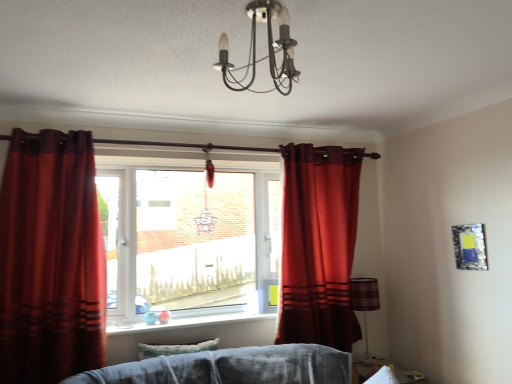
What do you see at coordinates (318, 245) in the screenshot? The image size is (512, 384). I see `matte red curtain at center, arranged as the 1th curtain when viewed from the right` at bounding box center [318, 245].

What do you see at coordinates (50, 259) in the screenshot? I see `velvet red curtain at left, the first curtain viewed from the left` at bounding box center [50, 259].

Where is `metallic chandelier at upper center`? metallic chandelier at upper center is located at coordinates (268, 50).

The height and width of the screenshot is (384, 512). What do you see at coordinates (193, 237) in the screenshot?
I see `clear glass window at center` at bounding box center [193, 237].

The width and height of the screenshot is (512, 384). What are the coordinates of `smooth glass window sill at center` in the screenshot? It's located at (182, 322).

Locate an element on the screen. matte red curtain at center, arranged as the 1th curtain when viewed from the right is located at coordinates (318, 245).

Is metallic chandelier at upper center positioned behind velvet red curtain at left, the first curtain viewed from the left?

No, it is not.

Is metallic chandelier at upper center to the left of velvet red curtain at left, the 2th curtain viewed from the back, from the viewer's perspective?

No.

Is metallic chandelier at upper center thinner than velvet red curtain at left, arranged as the second curtain when viewed from the right?

No.

Considering the sizes of objects metallic chandelier at upper center and velvet red curtain at left, the first curtain viewed from the left, in the image provided, who is bigger, metallic chandelier at upper center or velvet red curtain at left, the first curtain viewed from the left,?

velvet red curtain at left, the first curtain viewed from the left, is bigger.

Considering the sizes of objects metallic reflective picture frame at upper right and plaid fabric lampshade at lower right in the image provided, who is smaller, metallic reflective picture frame at upper right or plaid fabric lampshade at lower right?

With smaller size is metallic reflective picture frame at upper right.

Is there a large distance between metallic reflective picture frame at upper right and plaid fabric lampshade at lower right?

No, there isn't a large distance between metallic reflective picture frame at upper right and plaid fabric lampshade at lower right.

Is metallic reflective picture frame at upper right positioned with its back to plaid fabric lampshade at lower right?

No, metallic reflective picture frame at upper right is not facing away from plaid fabric lampshade at lower right.

Who is bigger, plaid fabric lampshade at lower right or metallic reflective picture frame at upper right?

plaid fabric lampshade at lower right.

Considering the sizes of objects plaid fabric lampshade at lower right and metallic reflective picture frame at upper right in the image provided, who is taller, plaid fabric lampshade at lower right or metallic reflective picture frame at upper right?

plaid fabric lampshade at lower right.

Is plaid fabric lampshade at lower right in contact with metallic reflective picture frame at upper right?

There is a gap between plaid fabric lampshade at lower right and metallic reflective picture frame at upper right.

From the image's perspective, which one is positioned higher, plaid fabric lampshade at lower right or metallic reflective picture frame at upper right?

metallic reflective picture frame at upper right, from the image's perspective.

Considering the relative positions of smooth glass window sill at center and matte red curtain at center, placed as the 1th curtain when sorted from back to front, in the image provided, is smooth glass window sill at center to the right of matte red curtain at center, placed as the 1th curtain when sorted from back to front, from the viewer's perspective?

In fact, smooth glass window sill at center is to the left of matte red curtain at center, placed as the 1th curtain when sorted from back to front.

Is smooth glass window sill at center positioned with its back to matte red curtain at center, arranged as the 1th curtain when viewed from the right?

smooth glass window sill at center is not turned away from matte red curtain at center, arranged as the 1th curtain when viewed from the right.

Is smooth glass window sill at center in contact with matte red curtain at center, placed as the second curtain when sorted from front to back?

No, smooth glass window sill at center is not with matte red curtain at center, placed as the second curtain when sorted from front to back.

Can you tell me how much smooth glass window sill at center and matte red curtain at center, placed as the 1th curtain when sorted from back to front, differ in facing direction?

1.2 degrees separate the facing orientations of smooth glass window sill at center and matte red curtain at center, placed as the 1th curtain when sorted from back to front.

Considering the relative positions of smooth glass window sill at center and velvet red curtain at left, arranged as the second curtain when viewed from the right, in the image provided, is smooth glass window sill at center to the right of velvet red curtain at left, arranged as the second curtain when viewed from the right, from the viewer's perspective?

Indeed, smooth glass window sill at center is positioned on the right side of velvet red curtain at left, arranged as the second curtain when viewed from the right.

What's the angular difference between smooth glass window sill at center and velvet red curtain at left, the 2th curtain viewed from the back,'s facing directions?

They differ by 0.247 degrees in their facing directions.

Find the location of a particular element. This screenshot has width=512, height=384. window sill directly beneath the velvet red curtain at left, the 1th curtain when ordered from front to back (from a real-world perspective) is located at coordinates (182, 322).

Which is closer to the camera, (267, 317) or (102, 231)?

Point (267, 317) appears to be farther away from the viewer than point (102, 231).

Between matte red curtain at center, positioned as the 2th curtain in left-to-right order, and plaid fabric lampshade at lower right, which one has more height?

matte red curtain at center, positioned as the 2th curtain in left-to-right order, is taller.

Considering the relative sizes of matte red curtain at center, placed as the second curtain when sorted from front to back, and plaid fabric lampshade at lower right in the image provided, is matte red curtain at center, placed as the second curtain when sorted from front to back, wider than plaid fabric lampshade at lower right?

Indeed, matte red curtain at center, placed as the second curtain when sorted from front to back, has a greater width compared to plaid fabric lampshade at lower right.

Is matte red curtain at center, placed as the second curtain when sorted from front to back, positioned before plaid fabric lampshade at lower right?

Yes, matte red curtain at center, placed as the second curtain when sorted from front to back, is in front of plaid fabric lampshade at lower right.

In terms of width, does clear glass window at center look wider or thinner when compared to metallic reflective picture frame at upper right?

Clearly, clear glass window at center has more width compared to metallic reflective picture frame at upper right.

In terms of size, does clear glass window at center appear bigger or smaller than metallic reflective picture frame at upper right?

Clearly, clear glass window at center is larger in size than metallic reflective picture frame at upper right.

Based on the photo, from a real-world perspective, is clear glass window at center positioned under metallic reflective picture frame at upper right based on gravity?

No, from a real-world perspective, clear glass window at center is not beneath metallic reflective picture frame at upper right.

Find the location of a particular element. This screenshot has width=512, height=384. curtain that is the 1st object located below the metallic chandelier at upper center (from the image's perspective) is located at coordinates (50, 259).

Locate an element on the screen. This screenshot has width=512, height=384. lamp on the left of metallic reflective picture frame at upper right is located at coordinates (365, 303).

Looking at the image, which one is located closer to metallic chandelier at upper center, clear glass window at center or plaid fabric lampshade at lower right?

Based on the image, clear glass window at center appears to be nearer to metallic chandelier at upper center.

Based on the photo, based on their spatial positions, is smooth glass window sill at center or matte red curtain at center, placed as the 1th curtain when sorted from back to front, further from plaid fabric lampshade at lower right?

Based on the image, smooth glass window sill at center appears to be further to plaid fabric lampshade at lower right.

Looking at the image, which one is located closer to plaid fabric lampshade at lower right, matte red curtain at center, positioned as the 2th curtain in left-to-right order, or clear glass window at center?

matte red curtain at center, positioned as the 2th curtain in left-to-right order, lies closer to plaid fabric lampshade at lower right than the other object.

When comparing their distances from velvet red curtain at left, arranged as the second curtain when viewed from the right, does matte red curtain at center, positioned as the 2th curtain in left-to-right order, or metallic chandelier at upper center seem further?

matte red curtain at center, positioned as the 2th curtain in left-to-right order, is further to velvet red curtain at left, arranged as the second curtain when viewed from the right.

Estimate the real-world distances between objects in this image. Which object is further from metallic reflective picture frame at upper right, metallic chandelier at upper center or plaid fabric lampshade at lower right?

Among the two, metallic chandelier at upper center is located further to metallic reflective picture frame at upper right.

Estimate the real-world distances between objects in this image. Which object is closer to metallic reflective picture frame at upper right, smooth glass window sill at center or matte red curtain at center, placed as the second curtain when sorted from front to back?

matte red curtain at center, placed as the second curtain when sorted from front to back, is closer to metallic reflective picture frame at upper right.

In the scene shown: Looking at the image, which one is located closer to smooth glass window sill at center, matte red curtain at center, placed as the second curtain when sorted from front to back, or velvet red curtain at left, the first curtain viewed from the left?

velvet red curtain at left, the first curtain viewed from the left, lies closer to smooth glass window sill at center than the other object.

Estimate the real-world distances between objects in this image. Which object is further from clear glass window at center, velvet red curtain at left, the 1th curtain when ordered from front to back, or smooth glass window sill at center?

velvet red curtain at left, the 1th curtain when ordered from front to back, lies further to clear glass window at center than the other object.

At what (x,y) coordinates should I click in order to perform the action: click on light fixture between smooth glass window sill at center and metallic reflective picture frame at upper right. Please return your answer as a coordinate pair (x, y). Looking at the image, I should click on (268, 50).

Where is `curtain situated between clear glass window at center and plaid fabric lampshade at lower right from left to right`? The height and width of the screenshot is (384, 512). curtain situated between clear glass window at center and plaid fabric lampshade at lower right from left to right is located at coordinates (318, 245).

The width and height of the screenshot is (512, 384). Find the location of `window located between smooth glass window sill at center and plaid fabric lampshade at lower right in the left-right direction`. window located between smooth glass window sill at center and plaid fabric lampshade at lower right in the left-right direction is located at coordinates (193, 237).

The width and height of the screenshot is (512, 384). Find the location of `window between metallic chandelier at upper center and plaid fabric lampshade at lower right from front to back`. window between metallic chandelier at upper center and plaid fabric lampshade at lower right from front to back is located at coordinates (193, 237).